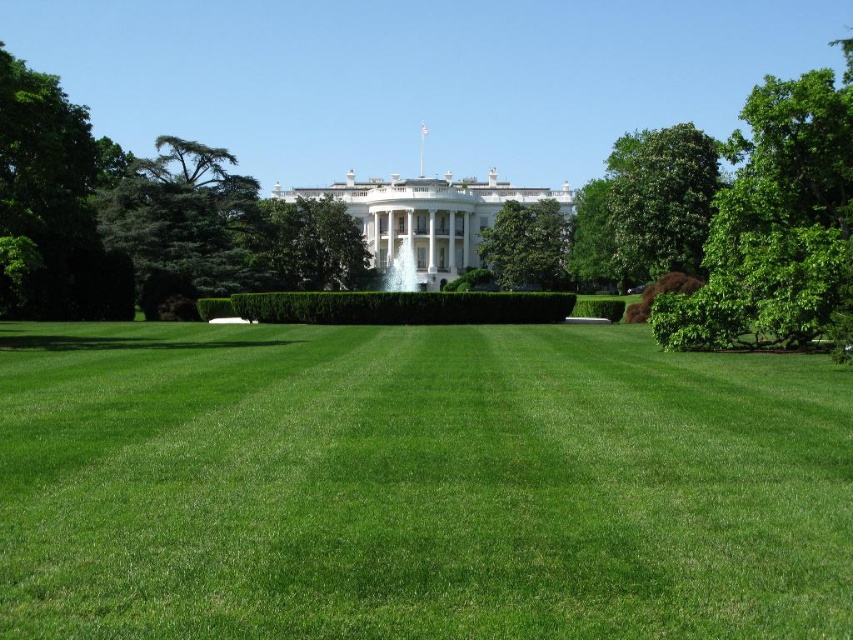
You are standing at the edge of the green smooth lawn at center and want to walk towards the green leafy tree at right. Which direction should you move to reach the tree?

You should move to the right because the green smooth lawn at center is to the left of the green leafy tree at right, so moving right from the lawn will lead you towards the tree.